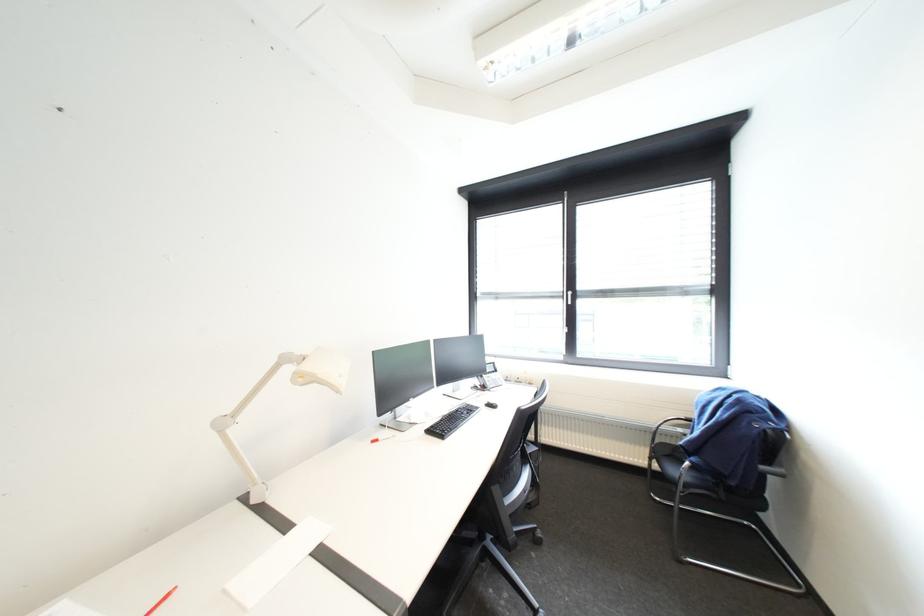
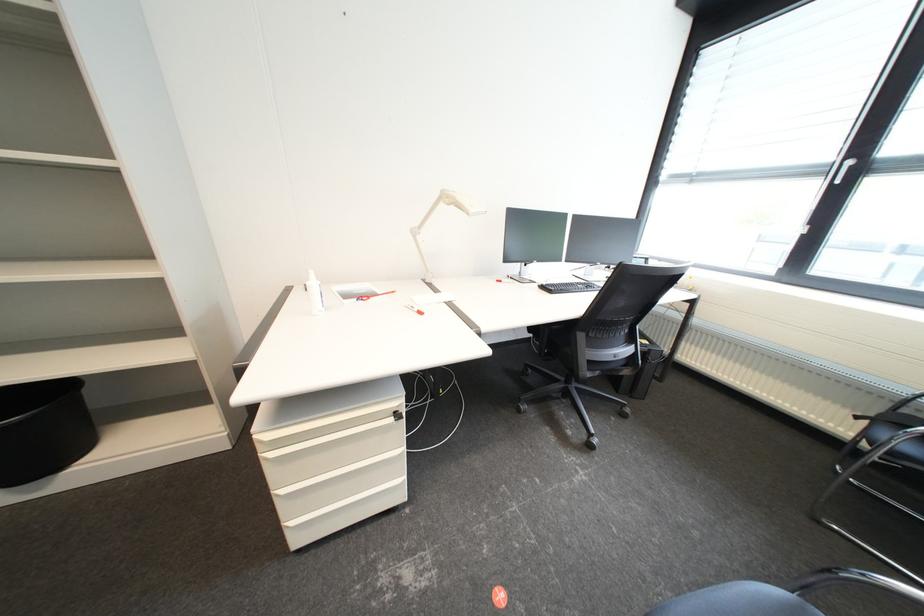
The images are taken continuously from a first-person perspective. In which direction is your viewpoint rotating?

The rotation direction of the camera is left-down.